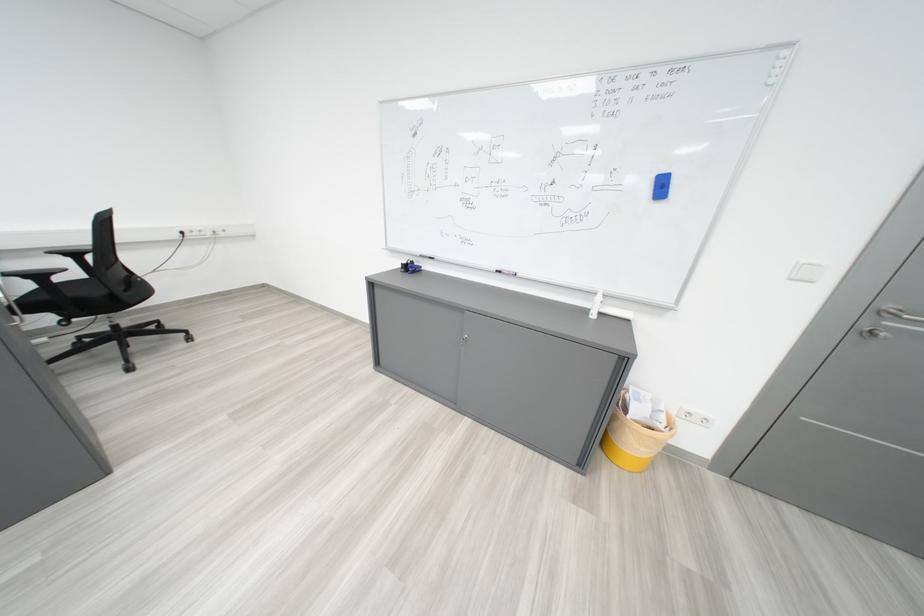
Where is `black chair sitting surface`? The height and width of the screenshot is (616, 924). black chair sitting surface is located at coordinates (86, 293).